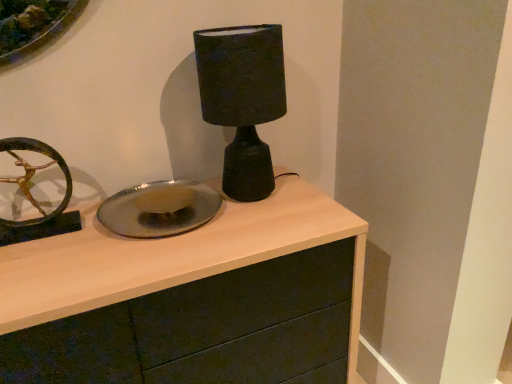
The height and width of the screenshot is (384, 512). I want to click on vacant area that is in front of shiny metallic plate at center, so click(130, 264).